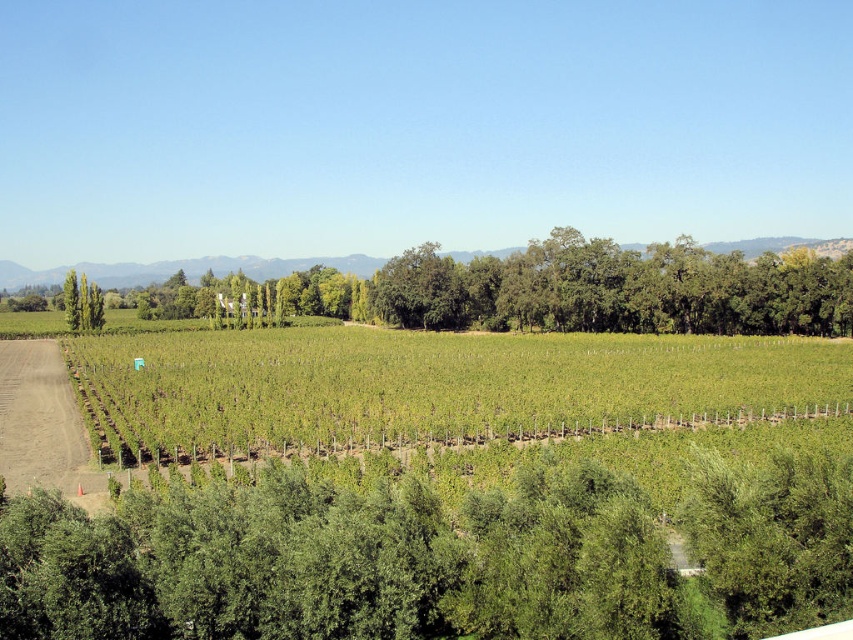
Question: Is green leafy tree at lower center positioned at the back of green grassy field at center?

Choices:
 (A) yes
 (B) no

Answer: (B)

Question: Which object is closer to the camera taking this photo?

Choices:
 (A) green leafy tree at lower center
 (B) green grassy field at center

Answer: (A)

Question: Is green leafy tree at lower center positioned at the back of green grassy field at center?

Choices:
 (A) no
 (B) yes

Answer: (A)

Question: Which of the following is the closest to the observer?

Choices:
 (A) (410, 488)
 (B) (236, 330)

Answer: (A)

Question: From the image, what is the correct spatial relationship of green leafy tree at lower center in relation to green grassy field at center?

Choices:
 (A) below
 (B) above

Answer: (A)